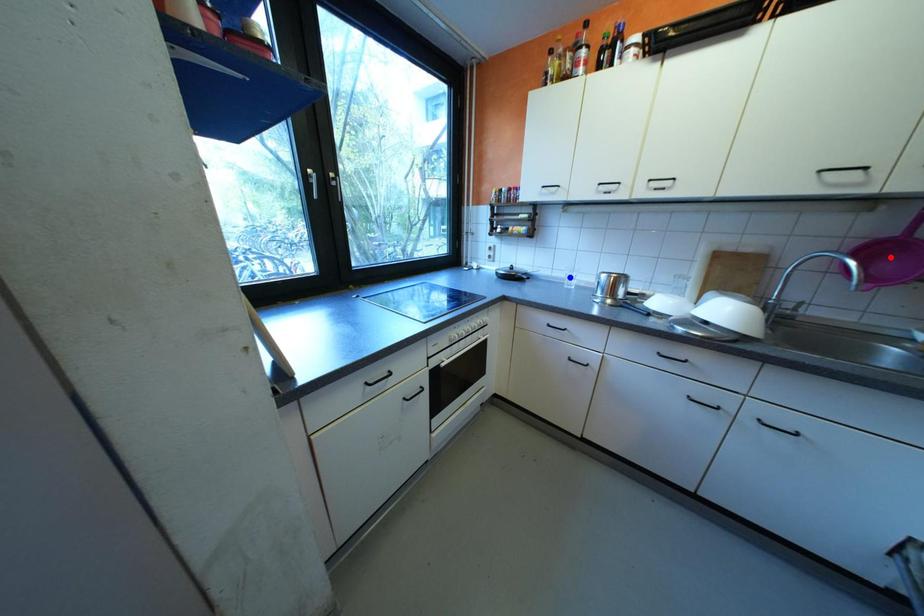
Question: In the image, two points are highlighted. Which point is nearer to the camera? Reply with the corresponding letter.

Choices:
 (A) blue point
 (B) red point

Answer: (B)